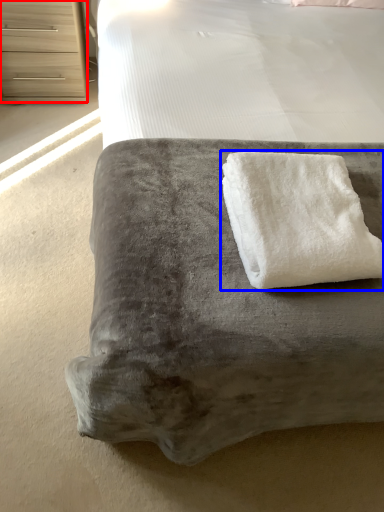
Question: Which point is further to the camera, chest of drawers (highlighted by a red box) or towel (highlighted by a blue box)?

Choices:
 (A) chest of drawers
 (B) towel

Answer: (A)